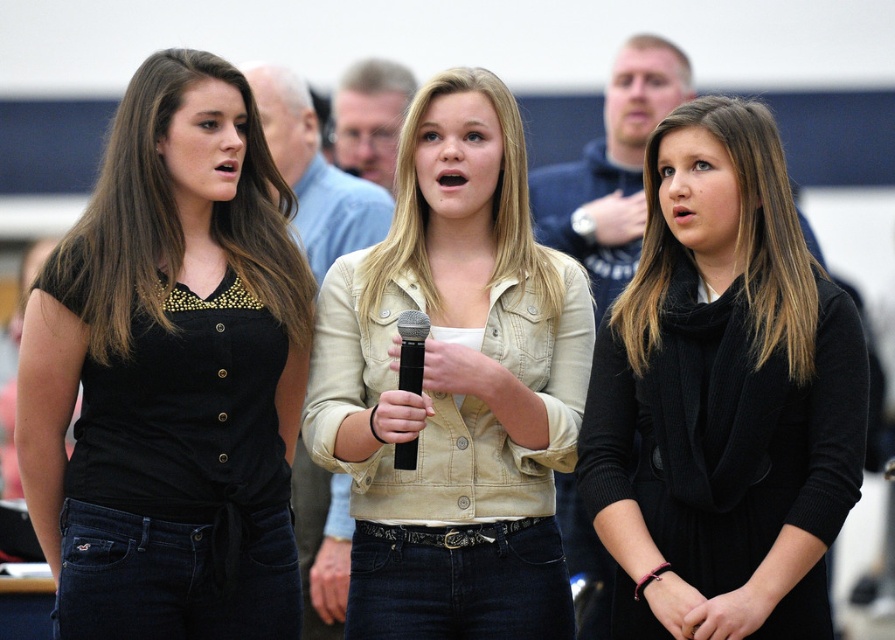
Can you confirm if beige button-up jacket at center is smaller than black matte microphone at center?

No.

Does point (458, 177) come in front of point (413, 392)?

No, it is not.

Is point (533, 250) farther from viewer compared to point (408, 356)?

Yes, it is behind point (408, 356).

In order to click on beige button-up jacket at center in this screenshot , I will do pyautogui.click(x=454, y=385).

Between black woolen scarf at center and beige button-up jacket at center, which one appears on the right side from the viewer's perspective?

black woolen scarf at center

Does black woolen scarf at center appear under beige button-up jacket at center?

Yes.

Who is more distant from viewer, (625, 381) or (444, 612)?

Point (444, 612)

Where is `black woolen scarf at center`? black woolen scarf at center is located at coordinates (722, 396).

Who is lower down, black matte shirt at left or black woolen scarf at center?

black woolen scarf at center

The image size is (895, 640). Identify the location of black matte shirt at left. (171, 372).

What do you see at coordinates (171, 372) in the screenshot? I see `black matte shirt at left` at bounding box center [171, 372].

Where is `black matte shirt at left`? Image resolution: width=895 pixels, height=640 pixels. black matte shirt at left is located at coordinates (171, 372).